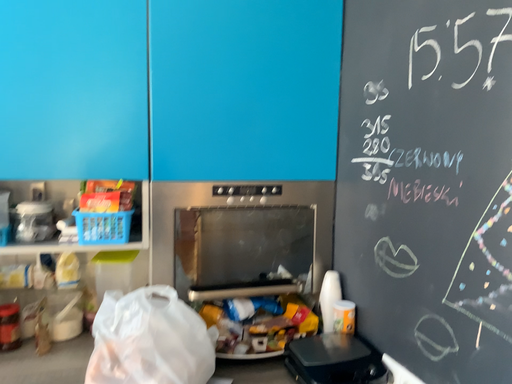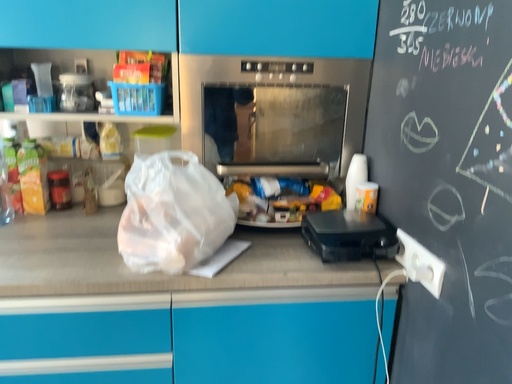
Question: Which way did the camera rotate in the video?

Choices:
 (A) rotated left
 (B) rotated right

Answer: (A)